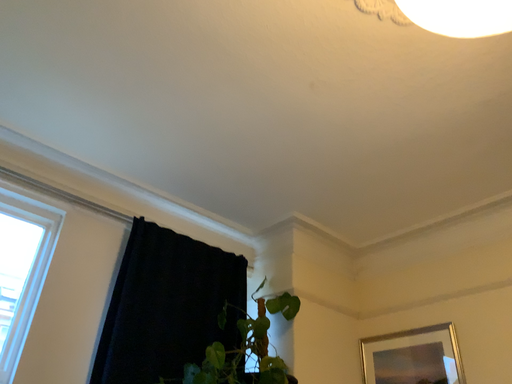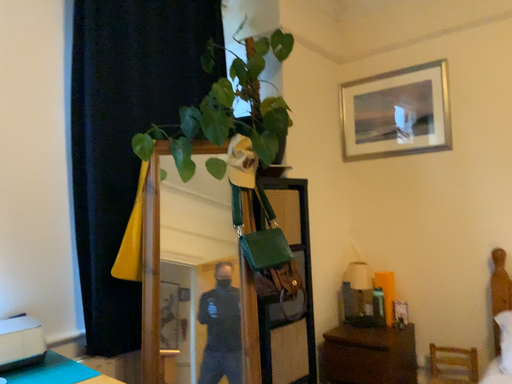
Question: Which way did the camera rotate in the video?

Choices:
 (A) rotated upward
 (B) rotated downward

Answer: (B)